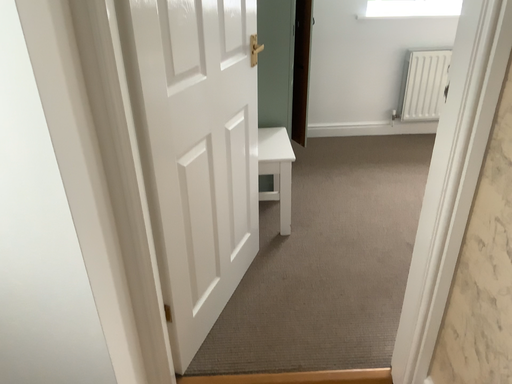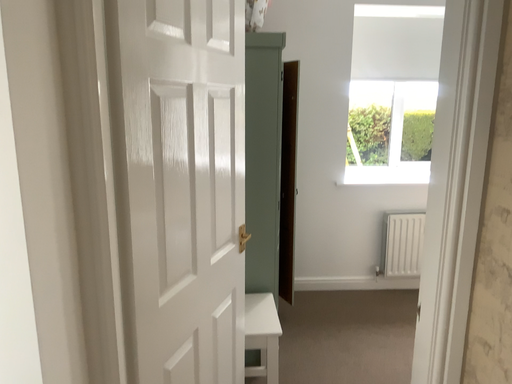
Question: Which way did the camera rotate in the video?

Choices:
 (A) rotated downward
 (B) rotated upward

Answer: (B)